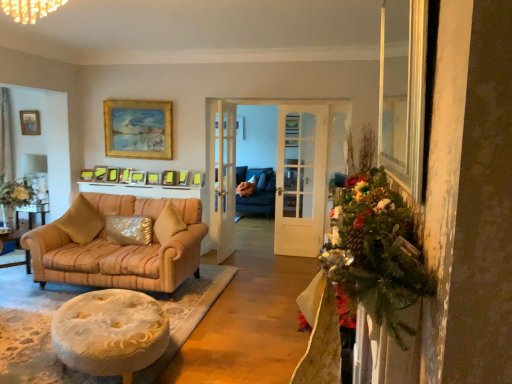
Image resolution: width=512 pixels, height=384 pixels. What do you see at coordinates (81, 221) in the screenshot?
I see `velvet gold pillow at center, the 2th pillow from the right` at bounding box center [81, 221].

The image size is (512, 384). Describe the element at coordinates (138, 129) in the screenshot. I see `gold-framed painting at upper center, the 5th picture frame in the right-to-left sequence` at that location.

The width and height of the screenshot is (512, 384). Find the location of `gold-framed picture at upper center, marked as the 9th picture frame in a left-to-right arrangement`. gold-framed picture at upper center, marked as the 9th picture frame in a left-to-right arrangement is located at coordinates (169, 178).

Describe the element at coordinates (129, 230) in the screenshot. I see `sparkly gold pillow at center, which is the 2th pillow in left-to-right order` at that location.

The width and height of the screenshot is (512, 384). Describe the element at coordinates (138, 178) in the screenshot. I see `matte gold picture frame at center, the seventh picture frame when ordered from left to right` at that location.

This screenshot has width=512, height=384. I want to click on velvet gold pillow at center, the 2th pillow from the right, so click(x=81, y=221).

Which object is more forward, gold-framed picture at upper center, the second picture frame viewed from the right, or velvet gold pillow at center, which is the first pillow from left to right?

velvet gold pillow at center, which is the first pillow from left to right, is in front.

From a real-world perspective, is gold-framed picture at upper center, the second picture frame viewed from the right, located higher than velvet gold pillow at center, the 2th pillow from the right?

Yes.

Between point (167, 173) and point (87, 234), which one is positioned behind?

The point (167, 173) is more distant.

Which is more to the left, gold-framed picture at upper center, marked as the 9th picture frame in a left-to-right arrangement, or velvet gold pillow at center, the 2th pillow from the right?

velvet gold pillow at center, the 2th pillow from the right, is more to the left.

From a real-world perspective, is beige fabric sofa at left positioned above or below velvet gold pillow at center, the 2th pillow from the right?

beige fabric sofa at left is below velvet gold pillow at center, the 2th pillow from the right.

Is beige fabric sofa at left beside velvet gold pillow at center, the 2th pillow from the right?

beige fabric sofa at left and velvet gold pillow at center, the 2th pillow from the right, are clearly separated.

Which object is further away from the camera, beige fabric sofa at left or velvet gold pillow at center, the 2th pillow from the right?

velvet gold pillow at center, the 2th pillow from the right, is further from the camera.

What's the angular difference between beige fabric sofa at left and velvet gold pillow at center, which is the first pillow from left to right,'s facing directions?

4.97 degrees.

Do you think white glossy lampshade at upper left is within beige fabric sofa at left, or outside of it?

white glossy lampshade at upper left exists outside the volume of beige fabric sofa at left.

From the image's perspective, is white glossy lampshade at upper left located beneath beige fabric sofa at left?

No, from the image's perspective, white glossy lampshade at upper left is not beneath beige fabric sofa at left.

Would you consider white glossy lampshade at upper left to be distant from beige fabric sofa at left?

Yes.

From a real-world perspective, is white glossy lampshade at upper left positioned above or below beige fabric sofa at left?

white glossy lampshade at upper left is situated higher than beige fabric sofa at left in the real world.

Is matte gold picture frame at upper center, which is the 3th picture frame in left-to-right order, to the left of gold-framed painting at upper center, the sixth picture frame from the left, from the viewer's perspective?

Yes, matte gold picture frame at upper center, which is the 3th picture frame in left-to-right order, is to the left of gold-framed painting at upper center, the sixth picture frame from the left.

Does matte gold picture frame at upper center, which is counted as the 8th picture frame, starting from the right, touch gold-framed painting at upper center, the sixth picture frame from the left?

No, matte gold picture frame at upper center, which is counted as the 8th picture frame, starting from the right, is not touching gold-framed painting at upper center, the sixth picture frame from the left.

Is gold-framed painting at upper center, the 5th picture frame in the right-to-left sequence, located within matte gold picture frame at upper center, which is counted as the 8th picture frame, starting from the right?

Definitely not — gold-framed painting at upper center, the 5th picture frame in the right-to-left sequence, is not inside matte gold picture frame at upper center, which is counted as the 8th picture frame, starting from the right.

Looking at their sizes, would you say sparkly gold pillow at center, the first pillow when ordered from right to left, is wider or thinner than matte gold picture frame at upper center, which is the 3th picture frame in left-to-right order?

Considering their sizes, sparkly gold pillow at center, the first pillow when ordered from right to left, looks broader than matte gold picture frame at upper center, which is the 3th picture frame in left-to-right order.

Can you tell me how much sparkly gold pillow at center, the first pillow when ordered from right to left, and matte gold picture frame at upper center, which is counted as the 8th picture frame, starting from the right, differ in facing direction?

The angular difference between sparkly gold pillow at center, the first pillow when ordered from right to left, and matte gold picture frame at upper center, which is counted as the 8th picture frame, starting from the right, is 30.4 degrees.

In the scene shown: Relative to matte gold picture frame at upper center, which is the 3th picture frame in left-to-right order, is sparkly gold pillow at center, which is the 2th pillow in left-to-right order, in front or behind?

Visually, sparkly gold pillow at center, which is the 2th pillow in left-to-right order, is located in front of matte gold picture frame at upper center, which is the 3th picture frame in left-to-right order.

Between point (125, 223) and point (106, 167), which one is positioned in front?

The point (125, 223) is closer to the camera.

Considering the relative sizes of white glossy lampshade at upper left and matte gold picture frame at upper center, which is the 3th picture frame in left-to-right order, in the image provided, is white glossy lampshade at upper left thinner than matte gold picture frame at upper center, which is the 3th picture frame in left-to-right order,?

In fact, white glossy lampshade at upper left might be wider than matte gold picture frame at upper center, which is the 3th picture frame in left-to-right order.

Considering the relative sizes of white glossy lampshade at upper left and matte gold picture frame at upper center, which is the 3th picture frame in left-to-right order, in the image provided, is white glossy lampshade at upper left taller than matte gold picture frame at upper center, which is the 3th picture frame in left-to-right order,?

Indeed, white glossy lampshade at upper left has a greater height compared to matte gold picture frame at upper center, which is the 3th picture frame in left-to-right order.

Is white glossy lampshade at upper left inside or outside of matte gold picture frame at upper center, which is the 3th picture frame in left-to-right order?

white glossy lampshade at upper left is located beyond the bounds of matte gold picture frame at upper center, which is the 3th picture frame in left-to-right order.

Is matte gold picture frame at center, the 1th picture frame viewed from the right, wider or thinner than beige fabric sofa at left?

matte gold picture frame at center, the 1th picture frame viewed from the right, is thinner than beige fabric sofa at left.

Between matte gold picture frame at center, the tenth picture frame from the left, and beige fabric sofa at left, which one appears on the left side from the viewer's perspective?

Positioned to the left is beige fabric sofa at left.

Is matte gold picture frame at center, the tenth picture frame from the left, aimed at beige fabric sofa at left?

Yes, matte gold picture frame at center, the tenth picture frame from the left, faces towards beige fabric sofa at left.

Is matte gold picture frame at center, the 1th picture frame viewed from the right, shorter than beige fabric sofa at left?

Correct, matte gold picture frame at center, the 1th picture frame viewed from the right, is not as tall as beige fabric sofa at left.

The width and height of the screenshot is (512, 384). Identify the location of the 2nd pillow to the left of the gold-framed picture at upper center, the second picture frame viewed from the right, starting your count from the anchor. (81, 221).

Image resolution: width=512 pixels, height=384 pixels. Find the location of `desk in front of the velvet gold pillow at center, which is the first pillow from left to right`. desk in front of the velvet gold pillow at center, which is the first pillow from left to right is located at coordinates (21, 263).

Looking at the image, which one is located further to white glossy lampshade at upper left, gold-framed painting at upper center, the sixth picture frame from the left, or matte gold picture frame at center, the 1th picture frame viewed from the right?

matte gold picture frame at center, the 1th picture frame viewed from the right, is further to white glossy lampshade at upper left.

Based on their spatial positions, is matte gold picture frame at center, placed as the 8th picture frame when sorted from left to right, or matte gold picture frame at upper center, which is counted as the 8th picture frame, starting from the right, further from gold metallic picture frame at upper left, the 10th picture frame in the right-to-left sequence?

matte gold picture frame at center, placed as the 8th picture frame when sorted from left to right, is positioned further to the anchor gold metallic picture frame at upper left, the 10th picture frame in the right-to-left sequence.

Based on their spatial positions, is gold metallic picture frame at upper left, which is counted as the 1th picture frame, starting from the left, or matte gold picture frame at upper center, which is the 3th picture frame in left-to-right order, further from matte gold picture frame at center, placed as the 8th picture frame when sorted from left to right?

gold metallic picture frame at upper left, which is counted as the 1th picture frame, starting from the left, is further to matte gold picture frame at center, placed as the 8th picture frame when sorted from left to right.

Estimate the real-world distances between objects in this image. Which object is closer to white glossy lampshade at upper left, velvet gold pillow at center, which is the first pillow from left to right, or gold-framed painting at upper center, the 5th picture frame in the right-to-left sequence?

The object closer to white glossy lampshade at upper left is gold-framed painting at upper center, the 5th picture frame in the right-to-left sequence.

Looking at the image, which one is located closer to white glossy lampshade at upper left, gold-framed painting at upper center, the sixth picture frame from the left, or matte gold picture frame at center, placed as the 8th picture frame when sorted from left to right?

gold-framed painting at upper center, the sixth picture frame from the left.

Based on their spatial positions, is gold-framed painting at upper center, the sixth picture frame from the left, or matte gold picture frame at center, the tenth picture frame from the left, closer to beige fabric sofa at left?

The object closer to beige fabric sofa at left is gold-framed painting at upper center, the sixth picture frame from the left.

When comparing their distances from matte gold picture frame at center, the third picture frame viewed from the right, does white glossy lampshade at upper left or gold metallic picture frame at upper left, the 10th picture frame in the right-to-left sequence, seem further?

gold metallic picture frame at upper left, the 10th picture frame in the right-to-left sequence.

From the picture: Considering their positions, is matte gold picture frame at center, the tenth picture frame from the left, positioned further to white glossy lampshade at upper left than gold-framed painting at upper center, the 5th picture frame in the right-to-left sequence?

The object further to white glossy lampshade at upper left is matte gold picture frame at center, the tenth picture frame from the left.

I want to click on lamp located between velvet gold pillow at center, which is the first pillow from left to right, and gold metallic picture frame at upper left, which is counted as the 1th picture frame, starting from the left, in the depth direction, so click(36, 174).

I want to click on lamp between gold metallic picture frame at upper left, which is counted as the 1th picture frame, starting from the left, and matte gold picture frame at center, the tenth picture frame from the left, from left to right, so click(36, 174).

At what (x,y) coordinates should I click in order to perform the action: click on picture frame situated between gold metallic picture frame at upper left, the 10th picture frame in the right-to-left sequence, and matte gold picture frame at upper center, which is counted as the 8th picture frame, starting from the right, from left to right. Please return your answer as a coordinate pair (x, y). Image resolution: width=512 pixels, height=384 pixels. Looking at the image, I should click on (86, 175).

The height and width of the screenshot is (384, 512). Identify the location of lamp between beige fabric sofa at left and matte gold picture frame at upper center, the 4th picture frame from the left, in the front-back direction. (36, 174).